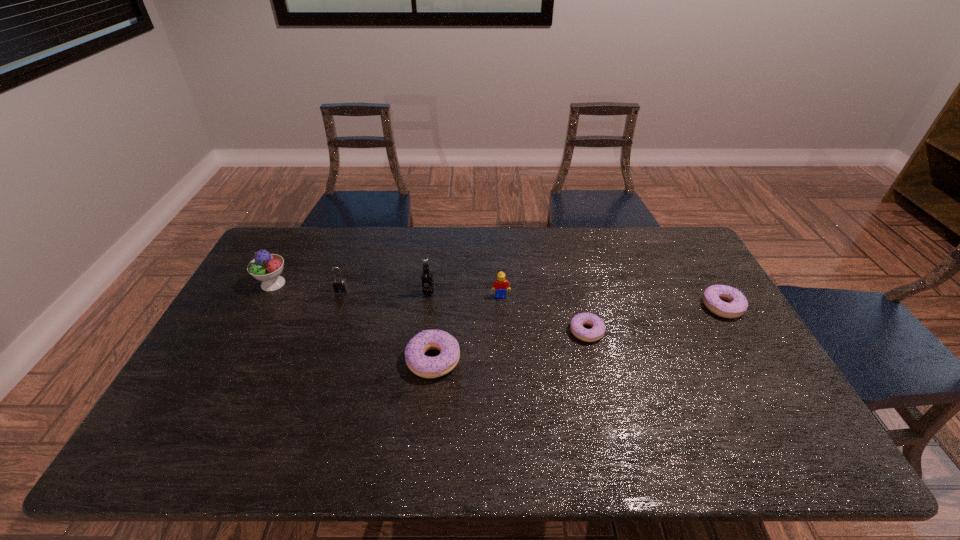
The width and height of the screenshot is (960, 540). Identify the location of free space that satisfies the following two spatial constraints: 1. on the shackle of the sixth object from left to right; 2. on the right side of the second object from left to right. (326, 332).

In order to click on blank area in the image that satisfies the following two spatial constraints: 1. on the label of the shortest doughnut; 2. on the left side of the root beer in this screenshot , I will do `click(423, 332)`.

This screenshot has width=960, height=540. In order to click on free spot that satisfies the following two spatial constraints: 1. on the shackle of the padlock; 2. on the right side of the second tallest doughnut in this screenshot , I will do `click(335, 307)`.